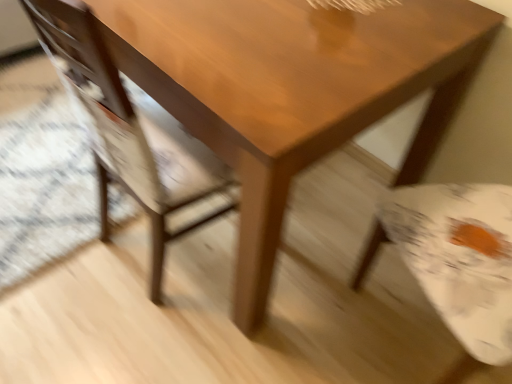
Question: Considering the positions of glossy wood table at center and matte wood chair at center in the image, is glossy wood table at center bigger or smaller than matte wood chair at center?

Choices:
 (A) big
 (B) small

Answer: (A)

Question: Is glossy wood table at center to the left or to the right of matte wood chair at center in the image?

Choices:
 (A) left
 (B) right

Answer: (B)

Question: Considering their positions, is glossy wood table at center located in front of or behind matte wood chair at center?

Choices:
 (A) front
 (B) behind

Answer: (B)

Question: Looking at the image, does matte wood chair at center seem bigger or smaller compared to glossy wood table at center?

Choices:
 (A) big
 (B) small

Answer: (B)

Question: From the image's perspective, is matte wood chair at center positioned above or below glossy wood table at center?

Choices:
 (A) above
 (B) below

Answer: (B)

Question: Considering the positions of matte wood chair at center and glossy wood table at center in the image, is matte wood chair at center wider or thinner than glossy wood table at center?

Choices:
 (A) wide
 (B) thin

Answer: (B)

Question: Is matte wood chair at center situated inside glossy wood table at center or outside?

Choices:
 (A) inside
 (B) outside

Answer: (A)